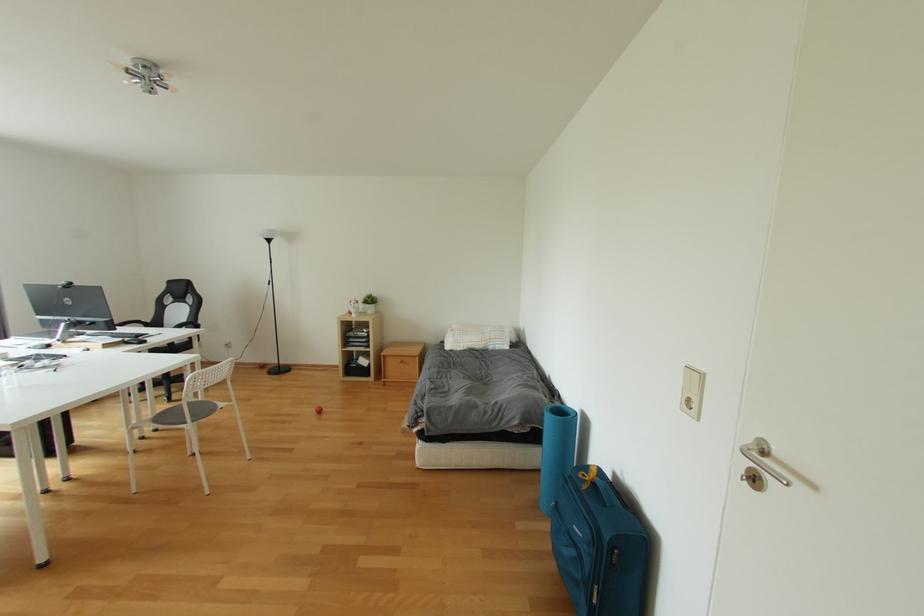
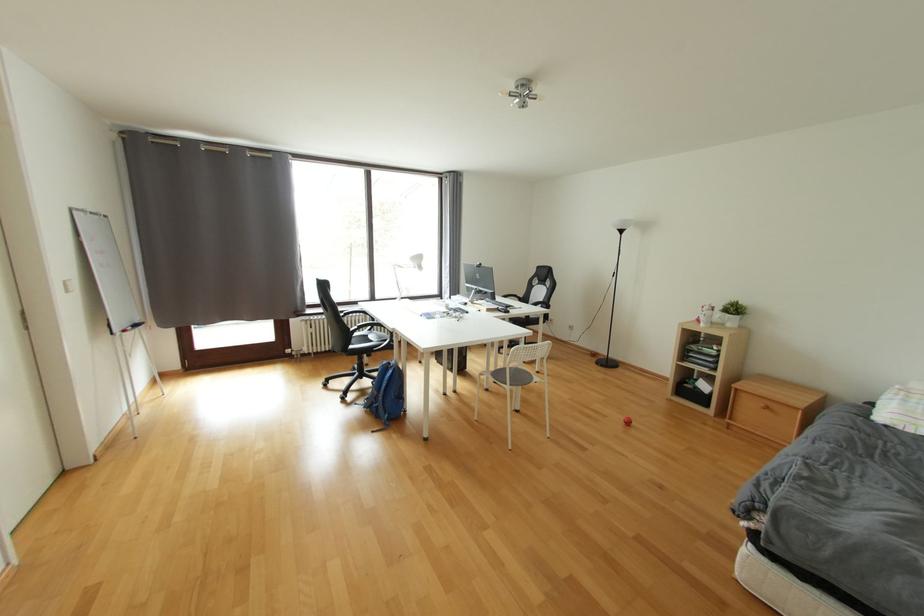
Question: The camera is either moving clockwise (left) or counter-clockwise (right) around the object. The first image is from the beginning of the video and the second image is from the end. Is the camera moving left or right when shooting the video?

Choices:
 (A) Left
 (B) Right

Answer: (B)